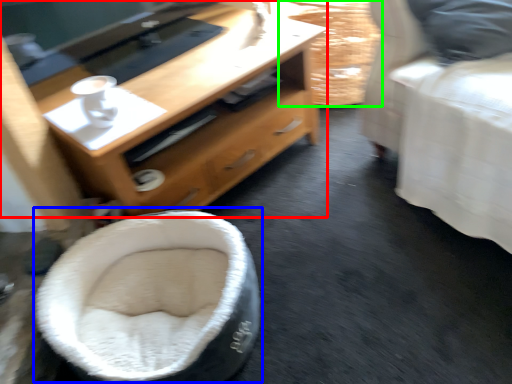
Question: Which object is positioned farthest from desk (highlighted by a red box)? Select from bean bag chair (highlighted by a blue box) and basket (highlighted by a green box).

Choices:
 (A) bean bag chair
 (B) basket

Answer: (B)